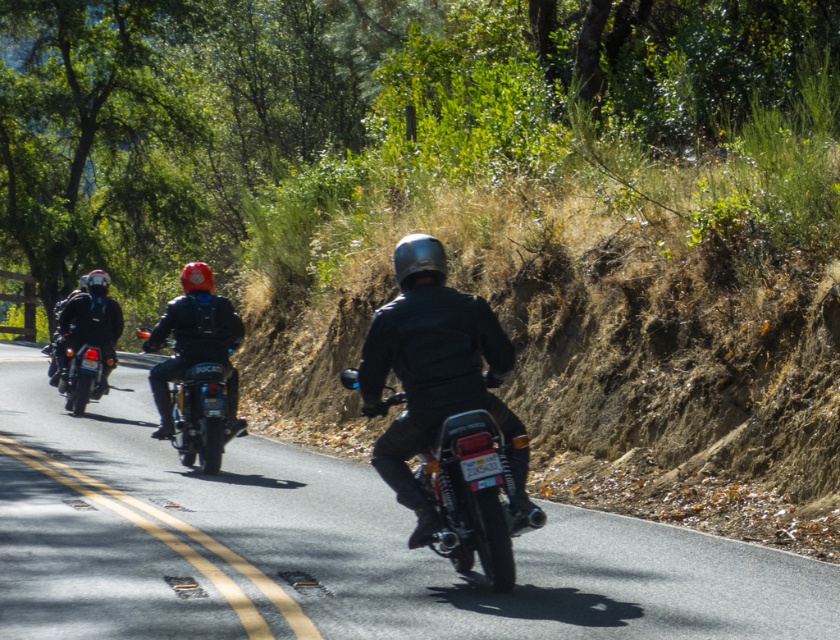
Question: Is matte black jacket at center smaller than shiny black motorcycle at center?

Choices:
 (A) yes
 (B) no

Answer: (A)

Question: Which object appears farthest from the camera in this image?

Choices:
 (A) shiny black motorcycle at center
 (B) matte black jacket at center
 (C) shiny chrome motorcycle at center

Answer: (A)

Question: Which point is farther to the camera?

Choices:
 (A) (474, 349)
 (B) (756, 624)
 (C) (210, 436)

Answer: (C)

Question: Does black asphalt road at center have a larger size compared to shiny black motorcycle at left?

Choices:
 (A) no
 (B) yes

Answer: (B)

Question: Estimate the real-world distances between objects in this image. Which object is farther from the shiny chrome motorcycle at center?

Choices:
 (A) black asphalt road at center
 (B) shiny black motorcycle at left
 (C) shiny black motorcycle at center

Answer: (B)

Question: Can you confirm if black asphalt road at center is positioned to the right of shiny chrome motorcycle at center?

Choices:
 (A) yes
 (B) no

Answer: (B)